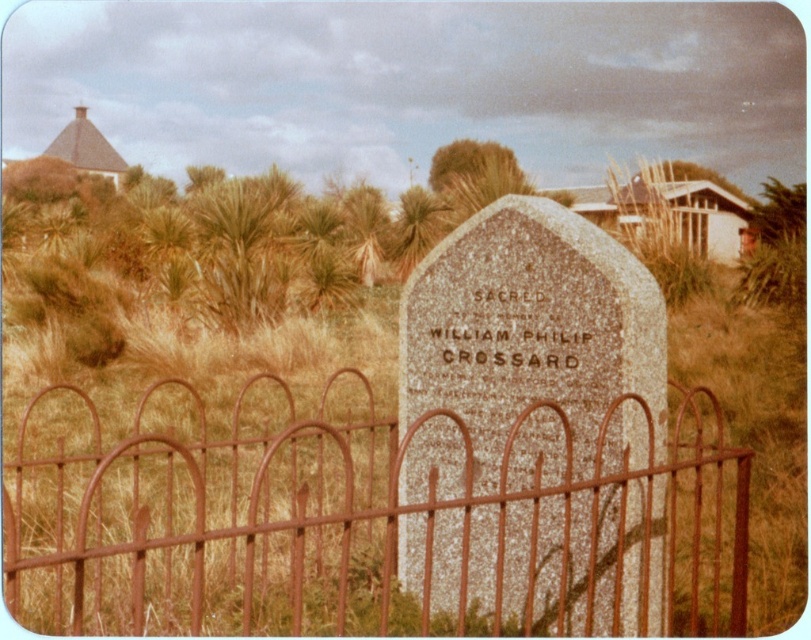
Question: Among these points, which one is nearest to the camera?

Choices:
 (A) (462, 314)
 (B) (337, 609)

Answer: (A)

Question: Does rusty metal fence at center have a smaller size compared to granite gravestone at center?

Choices:
 (A) no
 (B) yes

Answer: (B)

Question: Can you confirm if rusty metal fence at center is positioned above granite gravestone at center?

Choices:
 (A) no
 (B) yes

Answer: (A)

Question: Is rusty metal fence at center to the right of granite gravestone at center from the viewer's perspective?

Choices:
 (A) yes
 (B) no

Answer: (A)